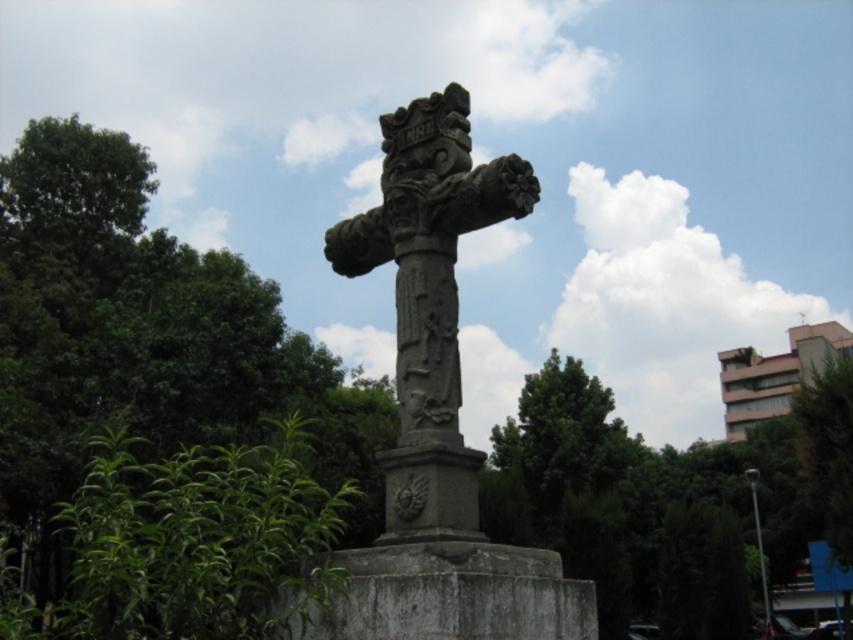
Looking at this image, is green leafy tree at upper left positioned before gray stone cross at center?

Yes.

Who is higher up, green leafy tree at upper left or gray stone cross at center?

Positioned higher is gray stone cross at center.

Image resolution: width=853 pixels, height=640 pixels. In order to click on green leafy tree at upper left in this screenshot , I will do `click(160, 408)`.

Find the location of a particular element. This screenshot has width=853, height=640. green leafy tree at upper left is located at coordinates (160, 408).